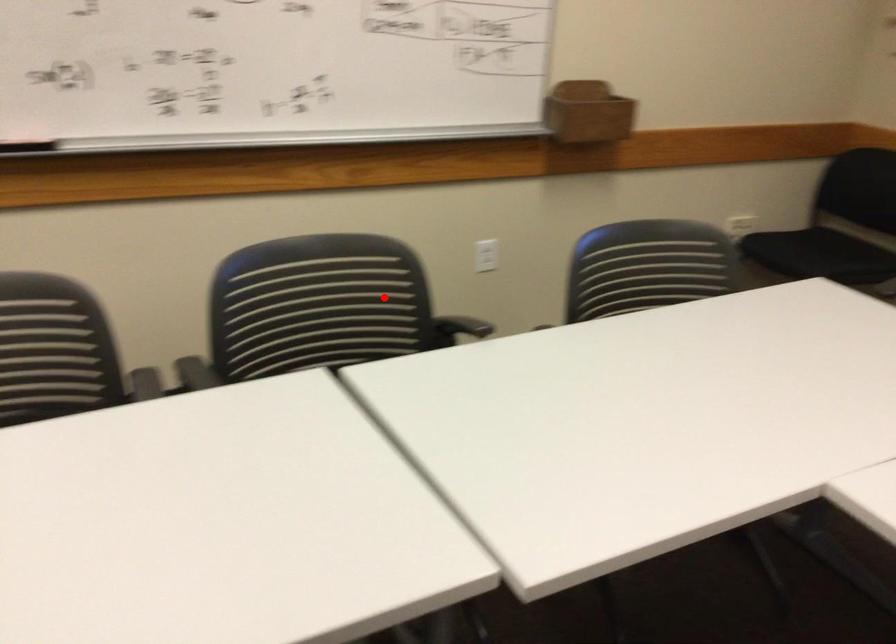
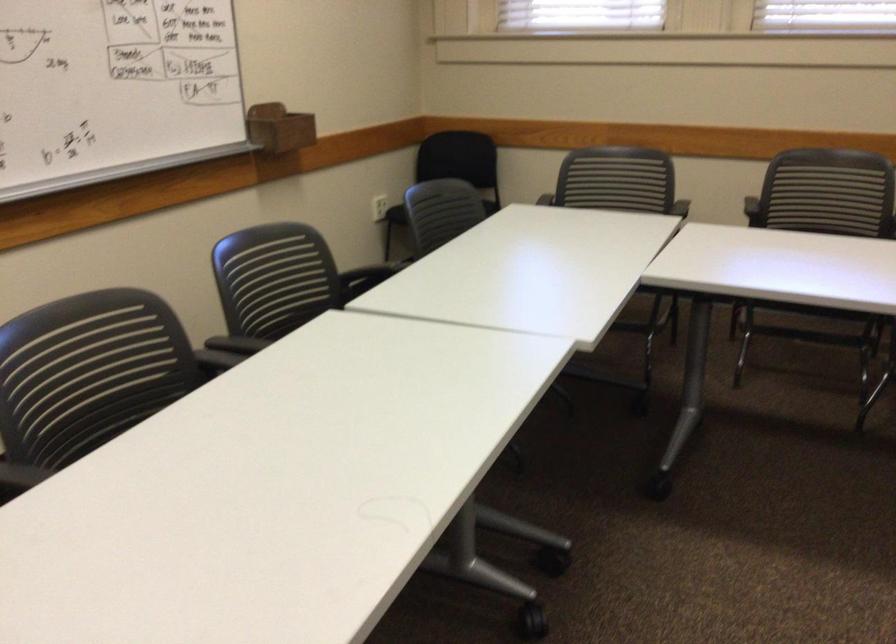
Find the pixel in the second image that matches the highlighted location in the first image.

(276, 277)